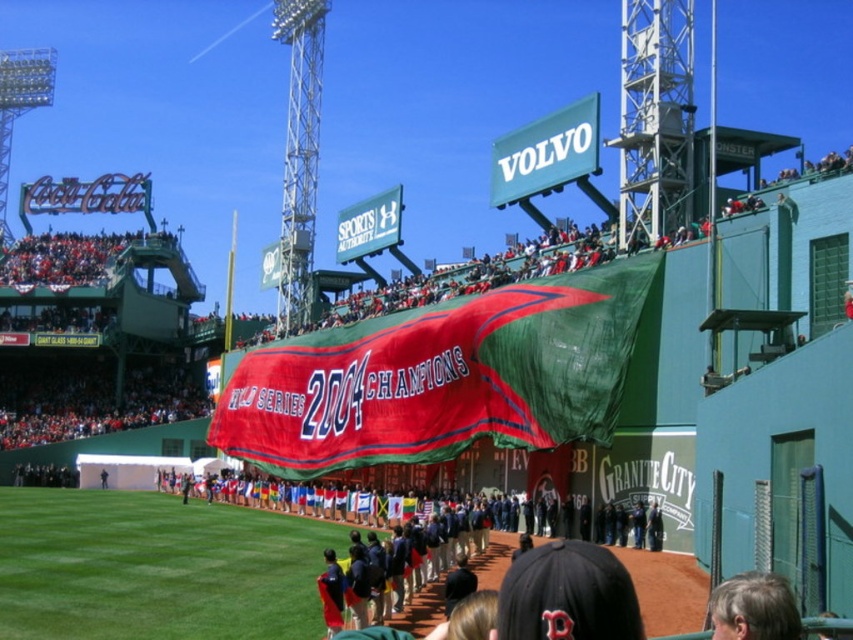
Based on the photo, you are standing at the center of the baseball stadium and want to take a photo of both the banner and the upper stands. The banner is located at point (577, 422) and the upper stands are at point (782, 577). Based on their positions, which object is closer to you?

Point (782, 577) is closer to you than point (577, 422), so the upper stands are closer to you than the banner.

Based on the photo, you are a photographer at the baseball stadium and want to capture a photo of the red fabric banner at center and the gray hair at lower right. Based on their sizes, which object should you focus on first if you want to ensure both are in frame without moving the camera?

The red fabric banner at center is taller than gray hair at lower right. Since the banner is larger, you should focus on positioning it first in the frame to ensure both fit without moving the camera.

You are a photographer at the baseball stadium and need to capture a photo that includes both the red fabric banner at center and the gray hair at lower right. Which object should you focus on first to ensure both are in frame?

The red fabric banner at center is larger in size than gray hair at lower right, so you should focus on the red fabric banner at center first to ensure both are in frame.